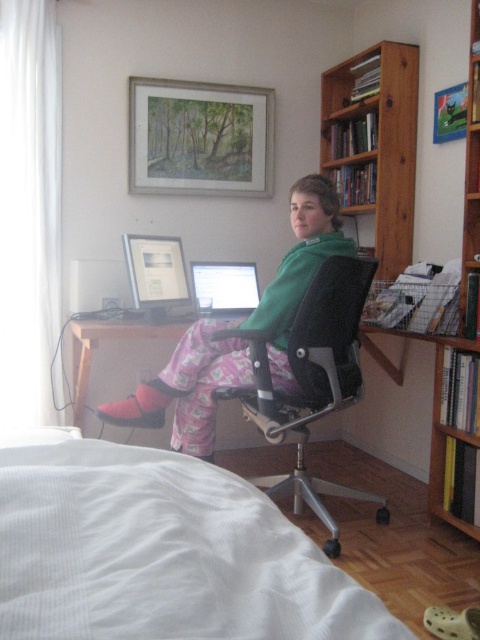
You are a delivery person who needs to place a large package on the floor behind the white textured bed at lower left and the wooden bookshelf at right. Can you place the package behind both objects at the same time?

The white textured bed at lower left is in front of the wooden bookshelf at right, so placing the package behind both would require positioning it behind the bed, which is in front of the bookshelf. This means the package can only be placed behind the bed, not both simultaneously.

You are designing a new layout for the room and want to place a 1.2 meter wide sofa between the white textured bed at lower left and the black mesh swivel chair at center. Given their widths, will the sofa fit in the space between them?

The white textured bed at lower left is narrower than the black mesh swivel chair at center. However, the question is about fitting a sofa between them based on their widths. Since the bed is narrower, but the exact distance between them isn not provided, we can only confirm their width comparison. Without knowing the actual space between them, we cannot determine if the sofa will fit. Please measure the distance between the two objects first.

You are a delivery person who needs to place a large package on the floor near the white textured bed at lower left. However, there is a black mesh swivel chair at center in the way. Can you move the chair to the side to make space?

The white textured bed at lower left is shorter than the black mesh swivel chair at center. Since the chair is taller, you can move it aside to create space near the bed.